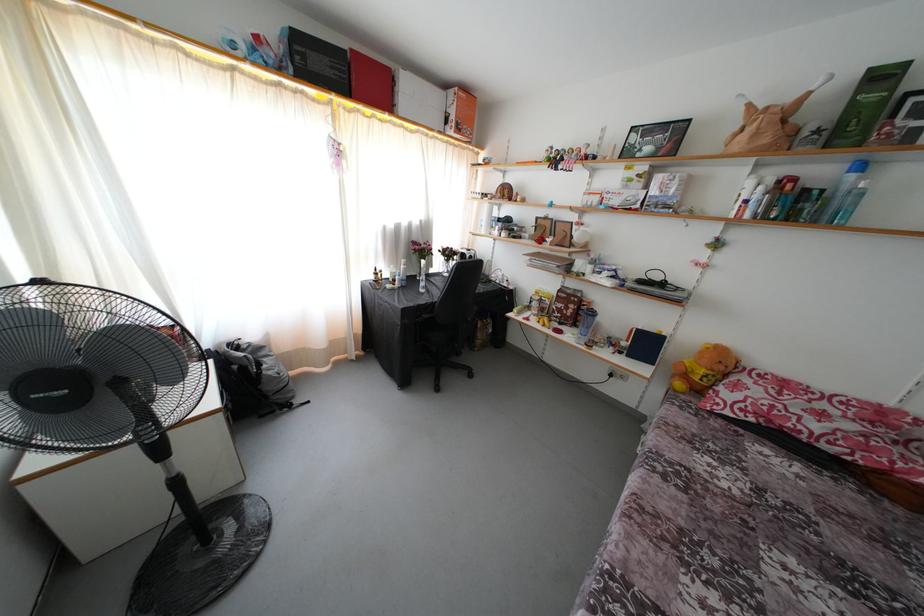
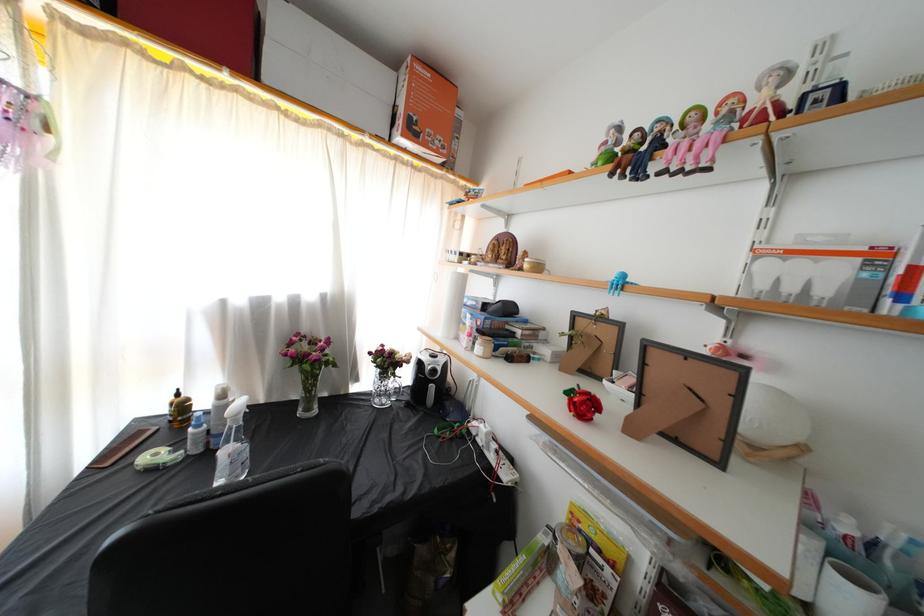
In the second image, find the point that corresponds to point (560, 167) in the first image.

(638, 161)